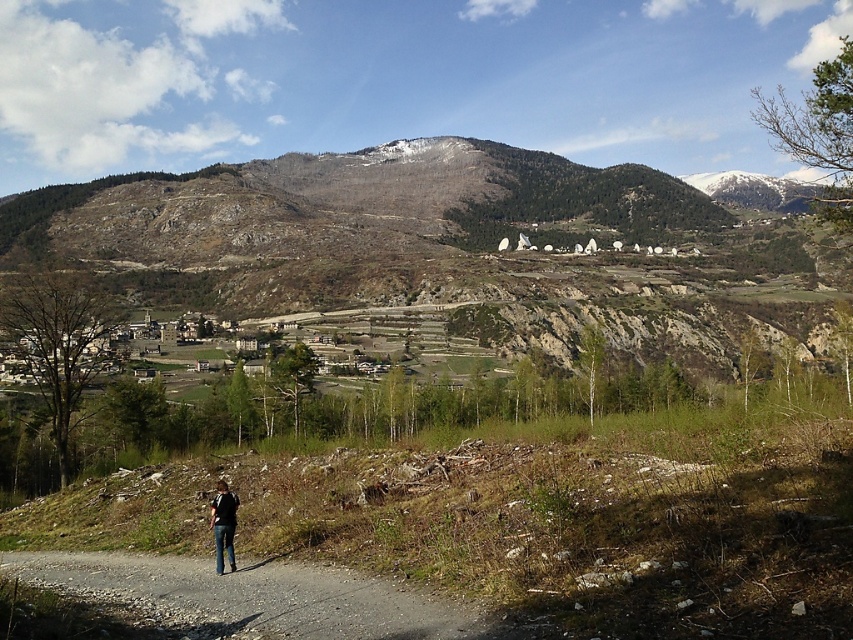
Question: Among these points, which one is nearest to the camera?

Choices:
 (A) (228, 524)
 (B) (234, 588)

Answer: (B)

Question: Does gray gravel path at lower left lie behind denim jacket at lower left?

Choices:
 (A) yes
 (B) no

Answer: (B)

Question: Can you confirm if gray gravel path at lower left is smaller than denim jacket at lower left?

Choices:
 (A) yes
 (B) no

Answer: (B)

Question: Which point appears farthest from the camera in this image?

Choices:
 (A) (209, 525)
 (B) (204, 636)

Answer: (A)

Question: Which object is farther from the camera taking this photo?

Choices:
 (A) denim jacket at lower left
 (B) gray gravel path at lower left

Answer: (A)

Question: Does gray gravel path at lower left appear under denim jacket at lower left?

Choices:
 (A) yes
 (B) no

Answer: (A)